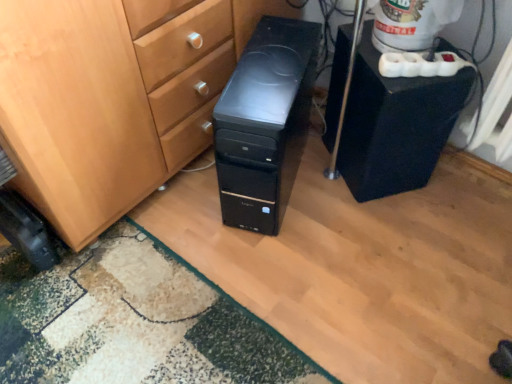
Image resolution: width=512 pixels, height=384 pixels. Identify the location of empty space that is ontop of green textured rug at lower left. (126, 321).